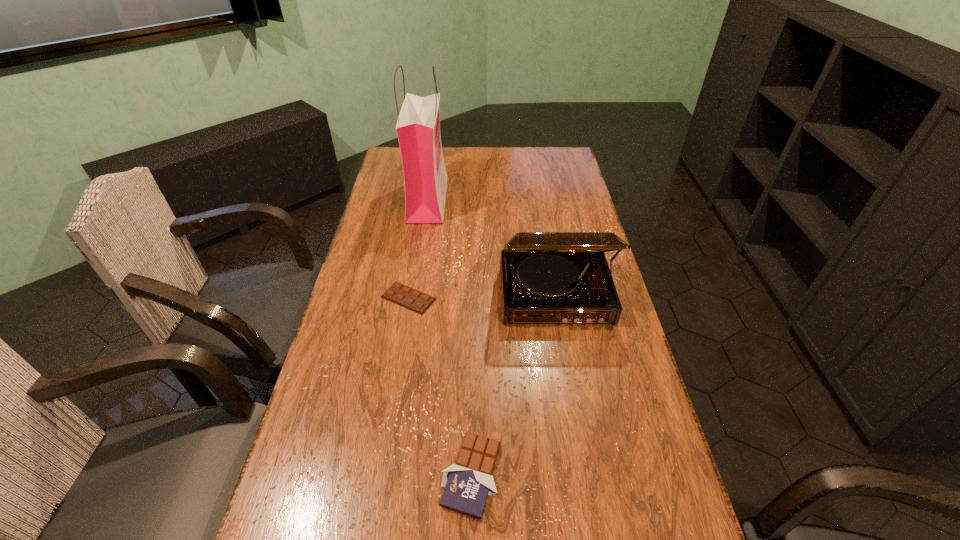
The image size is (960, 540). I want to click on the farthest object, so click(418, 127).

Locate an element on the screen. shopping bag is located at coordinates (418, 127).

The width and height of the screenshot is (960, 540). Find the location of `the second tallest object`. the second tallest object is located at coordinates (546, 277).

At what (x,y) coordinates should I click in order to perform the action: click on the rightmost object. Please return your answer as a coordinate pair (x, y). Looking at the image, I should click on 546,277.

You are a GUI agent. You are given a task and a screenshot of the screen. Output one action in this format:
    pyautogui.click(x=<x>, y=<y>)
    Task: Click on the nearer chocolate bar
    The height and width of the screenshot is (540, 960).
    Given the screenshot: What is the action you would take?
    pyautogui.click(x=467, y=483)

Image resolution: width=960 pixels, height=540 pixels. What are the coordinates of `the right chocolate bar` in the screenshot? It's located at (467, 483).

Find the location of `the shortest object`. the shortest object is located at coordinates (412, 299).

Locate an element on the screen. The width and height of the screenshot is (960, 540). the farther chocolate bar is located at coordinates (412, 299).

At what (x,y) coordinates should I click in order to perform the action: click on free spot located 0.220m on the front-facing side of the tallest object. Please return your answer as a coordinate pair (x, y). Looking at the image, I should click on (502, 199).

Image resolution: width=960 pixels, height=540 pixels. In order to click on free space located 0.330m on the front-facing side of the record player in this screenshot , I will do `click(580, 441)`.